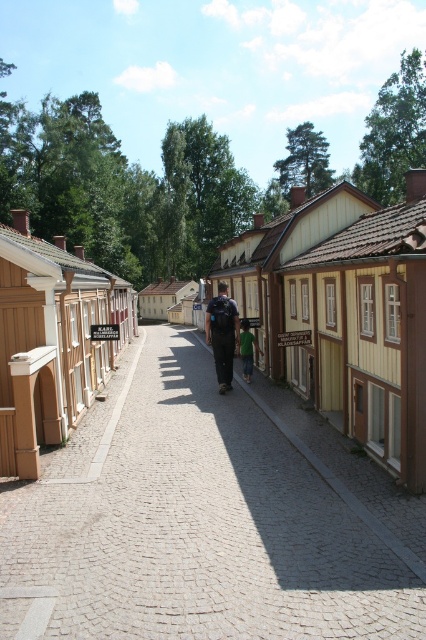
Is dark blue fabric backpack at center smaller than green fabric shirt at center?

No, dark blue fabric backpack at center is not smaller than green fabric shirt at center.

Is dark blue fabric backpack at center below green fabric shirt at center?

Actually, dark blue fabric backpack at center is above green fabric shirt at center.

Who is more forward, (x=221, y=316) or (x=247, y=324)?

Point (x=221, y=316) is more forward.

Identify the location of dark blue fabric backpack at center. (221, 333).

How distant is cobblestone alley at center from dark blue fabric backpack at center?

cobblestone alley at center and dark blue fabric backpack at center are 5.81 meters apart.

Based on the photo, does cobblestone alley at center appear over dark blue fabric backpack at center?

No, cobblestone alley at center is not above dark blue fabric backpack at center.

Where is `cobblestone alley at center`? This screenshot has width=426, height=640. cobblestone alley at center is located at coordinates (207, 518).

Which is behind, point (333, 339) or point (227, 300)?

The point (227, 300) is more distant.

Who is positioned more to the left, brown wooden houses at center or dark blue fabric backpack at center?

brown wooden houses at center

Is point (342, 182) positioned behind point (232, 330)?

No, (342, 182) is in front of (232, 330).

Identify the location of brown wooden houses at center. This screenshot has height=640, width=426. (344, 312).